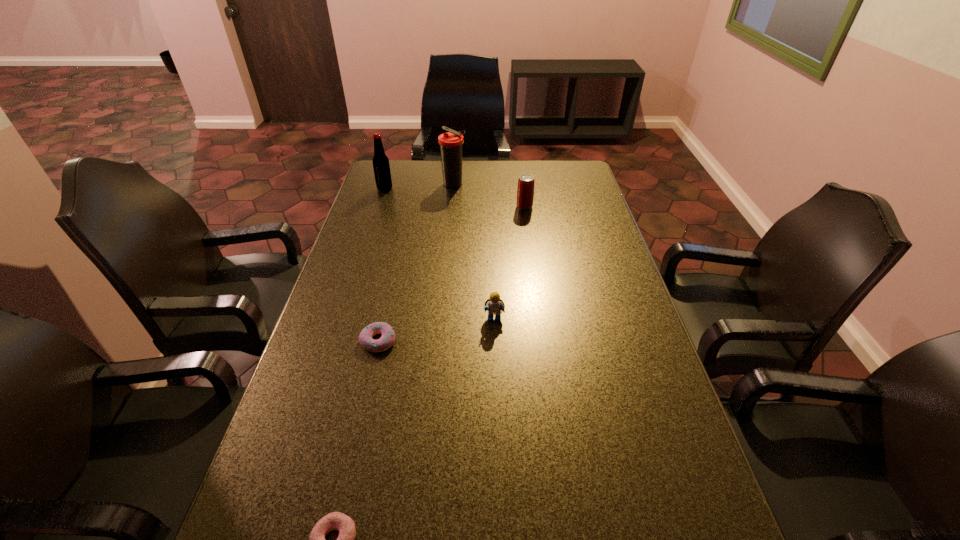
Point out which object is positioned as the nearest to the fourth farthest object. Please provide its 2D coordinates. Your answer should be formatted as a tuple, i.e. [(x, y)], where the tuple contains the x and y coordinates of a point satisfying the conditions above.

[(387, 339)]